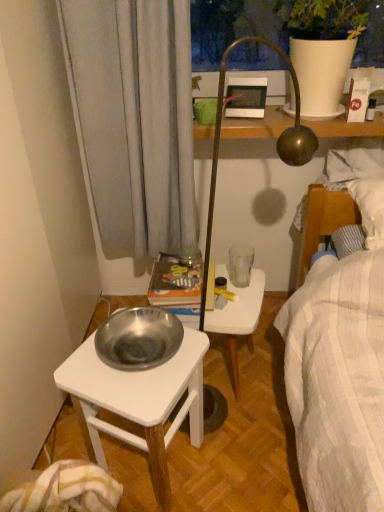
Question: Is white plastic stool at center to the right of matte white picture frame at upper center from the viewer's perspective?

Choices:
 (A) yes
 (B) no

Answer: (B)

Question: Can you confirm if white plastic stool at center is taller than matte white picture frame at upper center?

Choices:
 (A) no
 (B) yes

Answer: (B)

Question: From a real-world perspective, is white plastic stool at center on top of matte white picture frame at upper center?

Choices:
 (A) no
 (B) yes

Answer: (A)

Question: Can you confirm if white plastic stool at center is thinner than matte white picture frame at upper center?

Choices:
 (A) yes
 (B) no

Answer: (B)

Question: Considering the relative sizes of white plastic stool at center and matte white picture frame at upper center in the image provided, is white plastic stool at center wider than matte white picture frame at upper center?

Choices:
 (A) no
 (B) yes

Answer: (B)

Question: From the image's perspective, is white plastic stool at center located above matte white picture frame at upper center?

Choices:
 (A) yes
 (B) no

Answer: (B)

Question: From the image's perspective, would you say matte white picture frame at upper center is positioned over white plastic stool at center?

Choices:
 (A) no
 (B) yes

Answer: (B)

Question: Does matte white picture frame at upper center have a smaller size compared to white plastic stool at center?

Choices:
 (A) no
 (B) yes

Answer: (B)

Question: Is matte white picture frame at upper center surrounding white plastic stool at center?

Choices:
 (A) yes
 (B) no

Answer: (B)

Question: Is matte white picture frame at upper center outside white plastic stool at center?

Choices:
 (A) yes
 (B) no

Answer: (A)

Question: Does matte white picture frame at upper center have a greater height compared to white plastic stool at center?

Choices:
 (A) no
 (B) yes

Answer: (A)

Question: Considering the relative sizes of matte white picture frame at upper center and white plastic stool at center in the image provided, is matte white picture frame at upper center wider than white plastic stool at center?

Choices:
 (A) yes
 (B) no

Answer: (B)

Question: From the image's perspective, would you say silver metallic bowl at lower left is shown under white plastic stool at center?

Choices:
 (A) yes
 (B) no

Answer: (A)